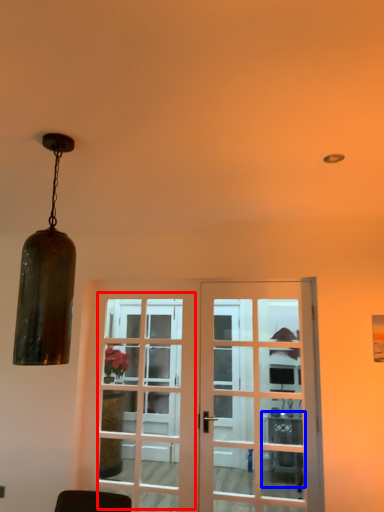
Question: Among these objects, which one is nearest to the camera, screen door (highlighted by a red box) or table (highlighted by a blue box)?

Choices:
 (A) screen door
 (B) table

Answer: (A)